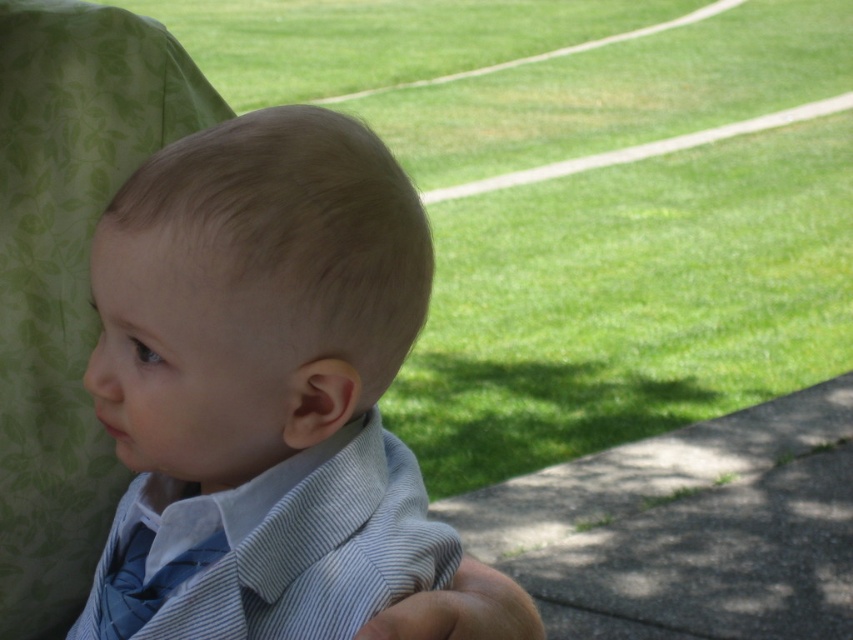
Is blue striped dress shirt at center smaller than blue striped tie at lower left?

Actually, blue striped dress shirt at center might be larger than blue striped tie at lower left.

Based on the photo, is blue striped dress shirt at center positioned before blue striped tie at lower left?

Yes, it is.

Which is in front, point (341, 570) or point (109, 624)?

Point (341, 570) is more forward.

The width and height of the screenshot is (853, 640). In order to click on blue striped dress shirt at center in this screenshot , I will do `click(280, 545)`.

Does point (326, 307) come farther from viewer compared to point (351, 529)?

No.

Between light brown hair at center and blue striped dress shirt at center, which one has less height?

blue striped dress shirt at center

Image resolution: width=853 pixels, height=640 pixels. I want to click on light brown hair at center, so click(x=271, y=397).

Locate an element on the screen. This screenshot has height=640, width=853. light brown hair at center is located at coordinates (271, 397).

Is light brown hair at center further to the viewer compared to blue striped tie at lower left?

No, light brown hair at center is in front of blue striped tie at lower left.

Does light brown hair at center appear under blue striped tie at lower left?

Incorrect, light brown hair at center is not positioned below blue striped tie at lower left.

You are a GUI agent. You are given a task and a screenshot of the screen. Output one action in this format:
    pyautogui.click(x=<x>, y=<y>)
    Task: Click on the light brown hair at center
    This screenshot has height=640, width=853.
    Given the screenshot: What is the action you would take?
    pyautogui.click(x=271, y=397)